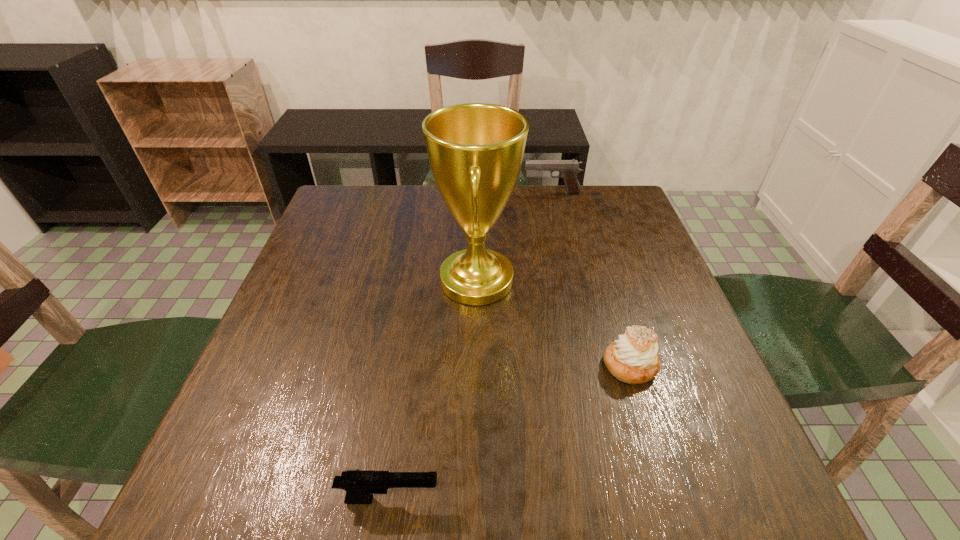
This screenshot has height=540, width=960. What are the coordinates of `award` in the screenshot? It's located at (475, 150).

Find the location of a particular element. The height and width of the screenshot is (540, 960). the tallest object is located at coordinates (475, 150).

Locate an element on the screen. Image resolution: width=960 pixels, height=540 pixels. the third shortest object is located at coordinates (568, 169).

I want to click on the right pistol, so click(x=568, y=169).

Identify the location of pastry. (633, 358).

This screenshot has width=960, height=540. In order to click on the nearer pistol in this screenshot , I will do `click(360, 486)`.

What are the coordinates of `the left pistol` in the screenshot? It's located at [360, 486].

I want to click on free spot located 0.220m by the handles of the tallest object, so click(x=609, y=281).

Where is `free space located at the barrel of the third shortest object`? free space located at the barrel of the third shortest object is located at coordinates (455, 193).

Locate an element on the screen. free spot located 0.120m at the barrel of the third shortest object is located at coordinates (485, 193).